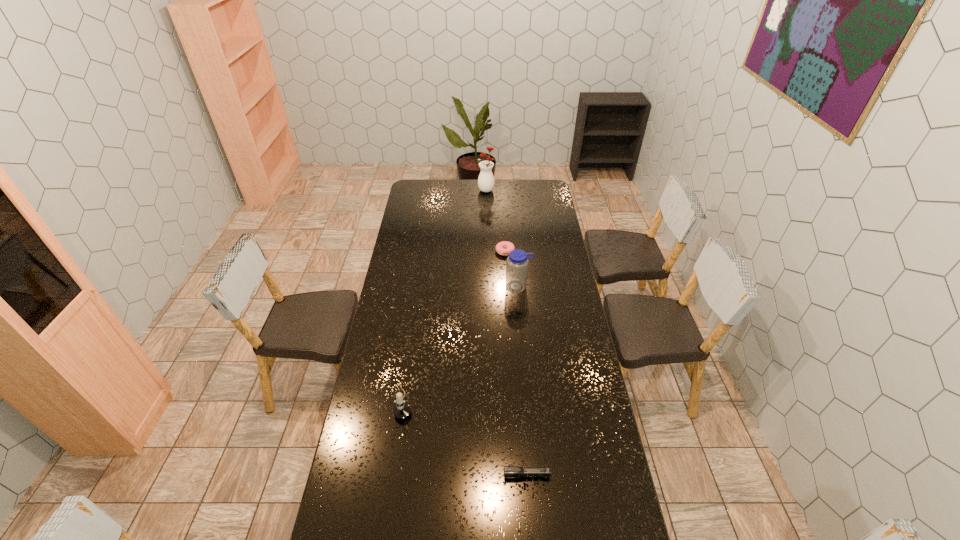
In the image, there is a desktop. At what (x,y) coordinates should I click in order to perform the action: click on vacant space at the far left corner. Please return your answer as a coordinate pair (x, y). The height and width of the screenshot is (540, 960). Looking at the image, I should click on (428, 194).

The width and height of the screenshot is (960, 540). Identify the location of vacant space at the far right corner of the desktop. (552, 193).

At what (x,y) coordinates should I click in order to perform the action: click on free space between the second nearest object and the nearest object. Please return your answer as a coordinate pair (x, y). Image resolution: width=960 pixels, height=540 pixels. Looking at the image, I should click on (466, 439).

Where is `free spot between the fourth nearest object and the nearest object`? free spot between the fourth nearest object and the nearest object is located at coordinates (516, 363).

I want to click on vacant space that is in between the tallest object and the water bottle, so click(503, 238).

What are the coordinates of `free spot between the farthest object and the flashlight` in the screenshot? It's located at (507, 333).

The height and width of the screenshot is (540, 960). Find the location of `free space between the farthest object and the fourth shortest object`. free space between the farthest object and the fourth shortest object is located at coordinates (503, 238).

Where is `unoccupied position between the third shortest object and the flashlight`? Image resolution: width=960 pixels, height=540 pixels. unoccupied position between the third shortest object and the flashlight is located at coordinates (466, 439).

Where is `vacant area between the water bottle and the leftmost object`? The width and height of the screenshot is (960, 540). vacant area between the water bottle and the leftmost object is located at coordinates (461, 345).

The height and width of the screenshot is (540, 960). I want to click on the closest object relative to the tallest object, so click(500, 247).